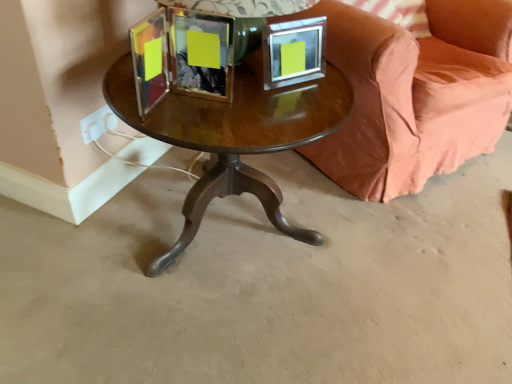
Identify the location of unoccupied region to the right of shiny brown wood coffee table at center. This screenshot has height=384, width=512. (409, 271).